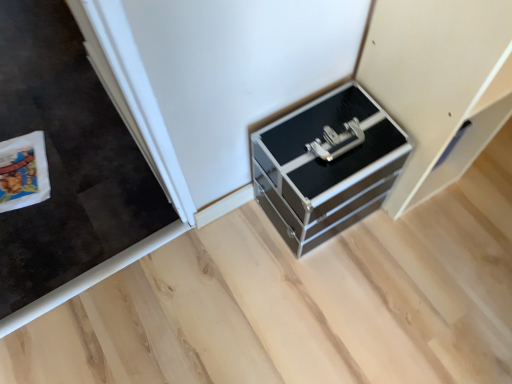
Question: Considering the positions of point (387, 114) and point (450, 137), is point (387, 114) closer or farther from the camera than point (450, 137)?

Choices:
 (A) closer
 (B) farther

Answer: (B)

Question: Is metallic black chest of drawers at center in front of or behind metallic silver drawer at lower right in the image?

Choices:
 (A) front
 (B) behind

Answer: (B)

Question: Is metallic black chest of drawers at center wider or thinner than metallic silver drawer at lower right?

Choices:
 (A) wide
 (B) thin

Answer: (B)

Question: Looking at their shapes, would you say metallic silver drawer at lower right is wider or thinner than metallic black chest of drawers at center?

Choices:
 (A) thin
 (B) wide

Answer: (B)

Question: Is point (422, 11) closer or farther from the camera than point (301, 226)?

Choices:
 (A) farther
 (B) closer

Answer: (B)

Question: Looking at the image, does metallic silver drawer at lower right seem bigger or smaller compared to metallic black chest of drawers at center?

Choices:
 (A) small
 (B) big

Answer: (B)

Question: Based on their positions, is metallic silver drawer at lower right located to the left or right of metallic black chest of drawers at center?

Choices:
 (A) right
 (B) left

Answer: (A)